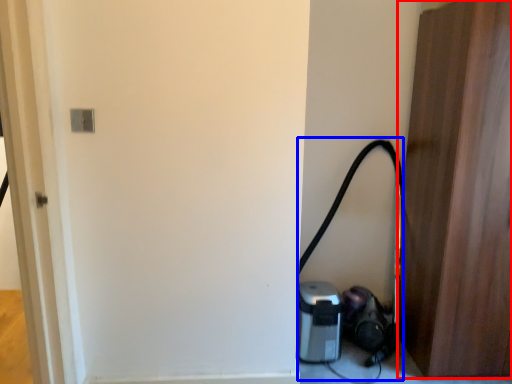
Question: Which object is further to the camera taking this photo, door (highlighted by a red box) or garden hose (highlighted by a blue box)?

Choices:
 (A) door
 (B) garden hose

Answer: (B)